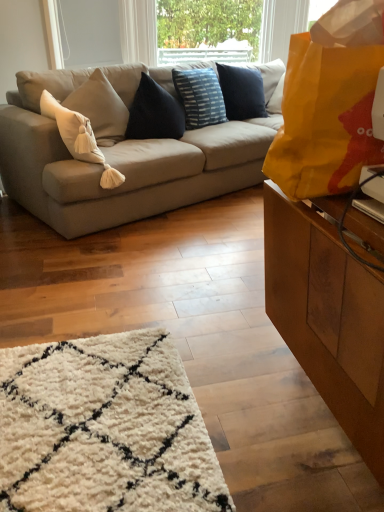
Question: Does yellow paper bag at right lie behind white soft cushion at left, positioned as the 2th pillow in right-to-left order?

Choices:
 (A) no
 (B) yes

Answer: (A)

Question: Is yellow paper bag at right next to white soft cushion at left, positioned as the 2th pillow in right-to-left order, and touching it?

Choices:
 (A) yes
 (B) no

Answer: (B)

Question: Can you confirm if yellow paper bag at right is thinner than white soft cushion at left, positioned as the 2th pillow in right-to-left order?

Choices:
 (A) yes
 (B) no

Answer: (A)

Question: Is yellow paper bag at right taller than white soft cushion at left, the 1th pillow viewed from the left?

Choices:
 (A) yes
 (B) no

Answer: (B)

Question: Is yellow paper bag at right oriented away from white soft cushion at left, the 1th pillow viewed from the left?

Choices:
 (A) no
 (B) yes

Answer: (A)

Question: Is point (208, 102) closer or farther from the camera than point (268, 158)?

Choices:
 (A) farther
 (B) closer

Answer: (A)

Question: From their relative heights in the image, would you say blue striped cushion at center, positioned as the 1th pillow in back-to-front order, is taller or shorter than yellow paper bag at right?

Choices:
 (A) short
 (B) tall

Answer: (B)

Question: Is blue striped cushion at center, arranged as the second pillow when viewed from the front, spatially inside yellow paper bag at right, or outside of it?

Choices:
 (A) outside
 (B) inside

Answer: (A)

Question: From the image's perspective, is blue striped cushion at center, the 1th pillow positioned from the right, located above or below yellow paper bag at right?

Choices:
 (A) above
 (B) below

Answer: (A)

Question: Considering the positions of point (211, 79) and point (76, 148), is point (211, 79) closer or farther from the camera than point (76, 148)?

Choices:
 (A) closer
 (B) farther

Answer: (B)

Question: Considering the relative positions of blue striped cushion at center, arranged as the second pillow when viewed from the front, and white soft cushion at left, positioned as the 2th pillow in right-to-left order, in the image provided, is blue striped cushion at center, arranged as the second pillow when viewed from the front, to the left or to the right of white soft cushion at left, positioned as the 2th pillow in right-to-left order,?

Choices:
 (A) right
 (B) left

Answer: (A)

Question: Is blue striped cushion at center, the 1th pillow positioned from the right, wider or thinner than white soft cushion at left, positioned as the 2th pillow in right-to-left order?

Choices:
 (A) wide
 (B) thin

Answer: (B)

Question: From the image's perspective, relative to white soft cushion at left, the first pillow viewed from the front, is blue striped cushion at center, which is the 2th pillow from left to right, above or below?

Choices:
 (A) below
 (B) above

Answer: (B)

Question: Considering the positions of beige fabric couch at center and yellow paper bag at right in the image, is beige fabric couch at center bigger or smaller than yellow paper bag at right?

Choices:
 (A) small
 (B) big

Answer: (B)

Question: From a real-world perspective, is beige fabric couch at center physically located above or below yellow paper bag at right?

Choices:
 (A) above
 (B) below

Answer: (B)